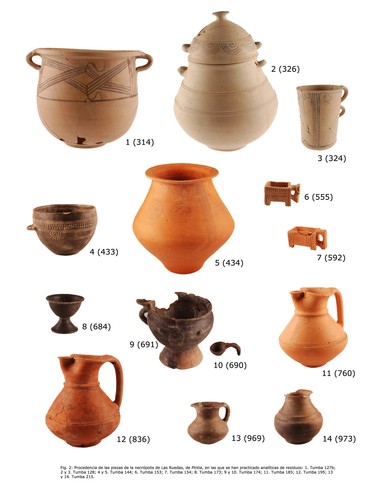
Find the location of a particular element. handles on urn upper center is located at coordinates (181, 69), (262, 62).